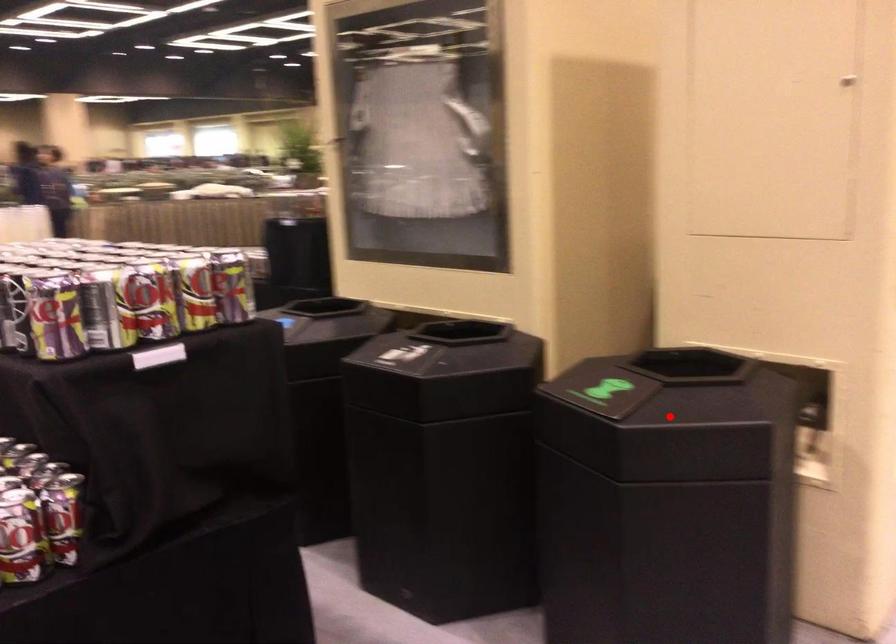
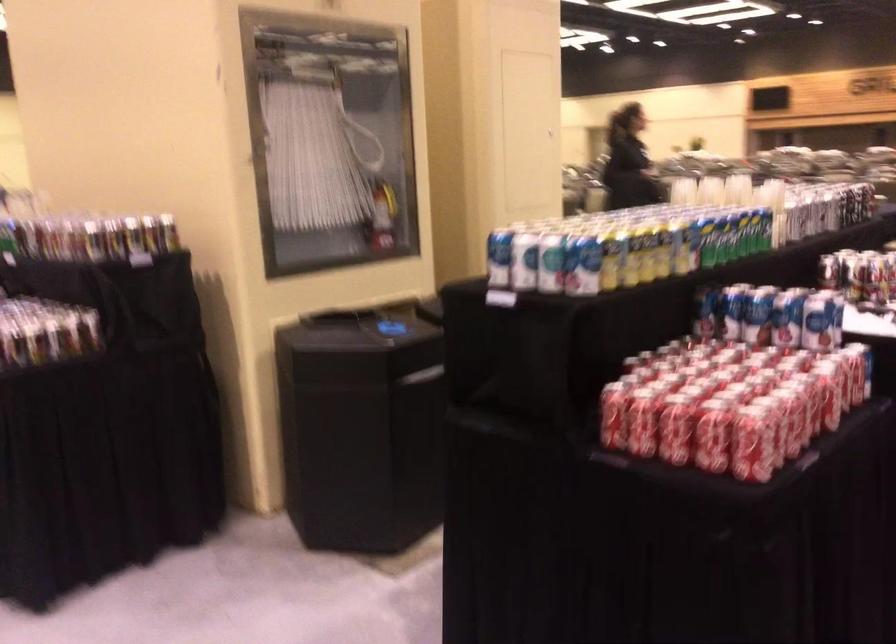
Question: I am providing you with two images of the same scene from different viewpoints. A red point is marked on the first image. Is the red point's position out of view in image 2?

Choices:
 (A) Yes
 (B) No

Answer: (A)